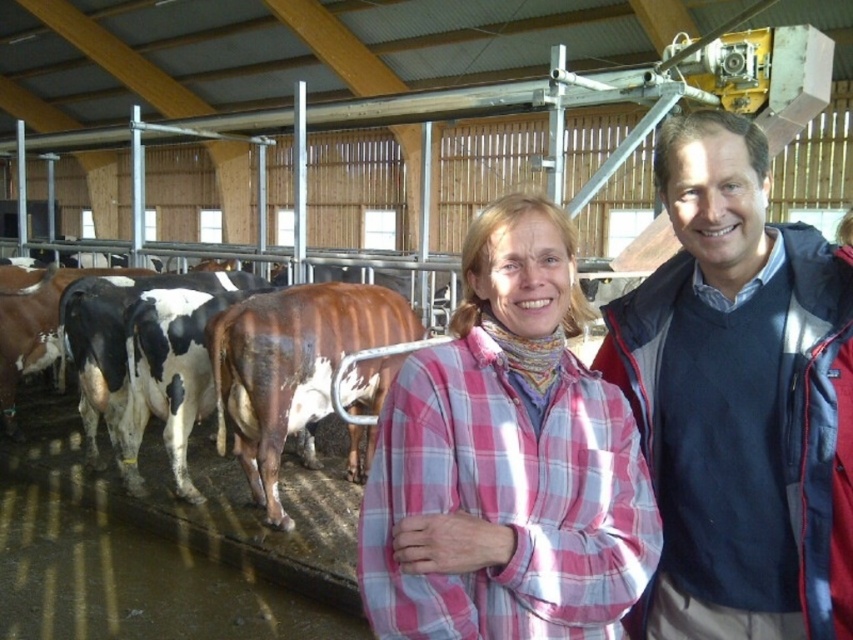
Between dark blue sweater at center and pink plaid shirt at center, which one is positioned lower?

pink plaid shirt at center

Who is more distant from viewer, (767, 353) or (541, 253)?

The point (767, 353) is more distant.

Image resolution: width=853 pixels, height=640 pixels. Identify the location of dark blue sweater at center. (740, 397).